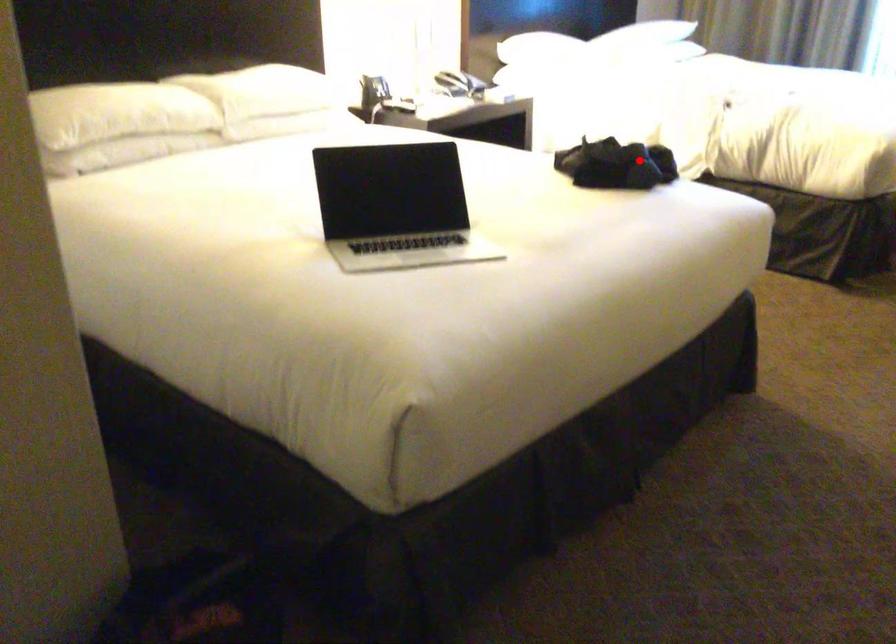
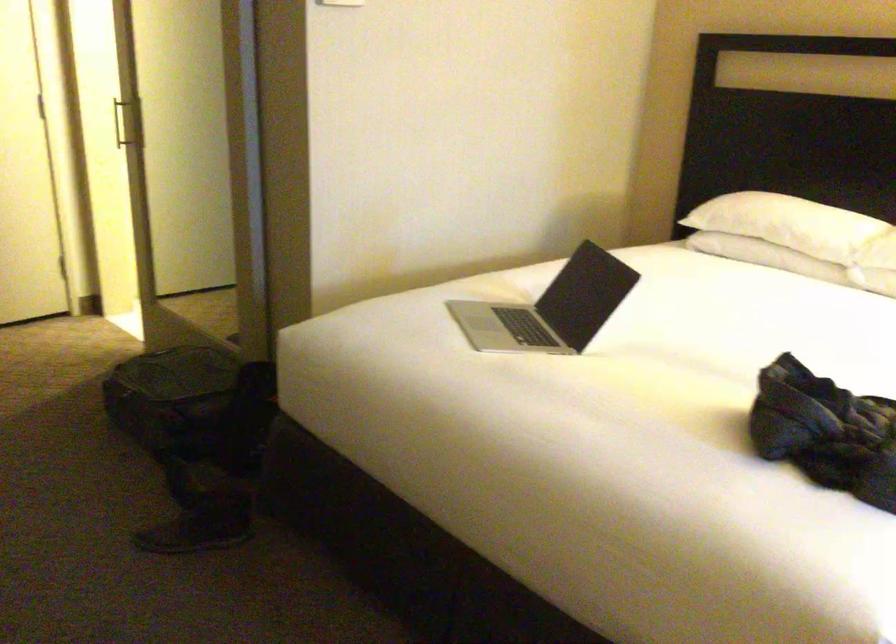
Where in the second image is the point corresponding to the highlighted location from the first image?

(825, 431)